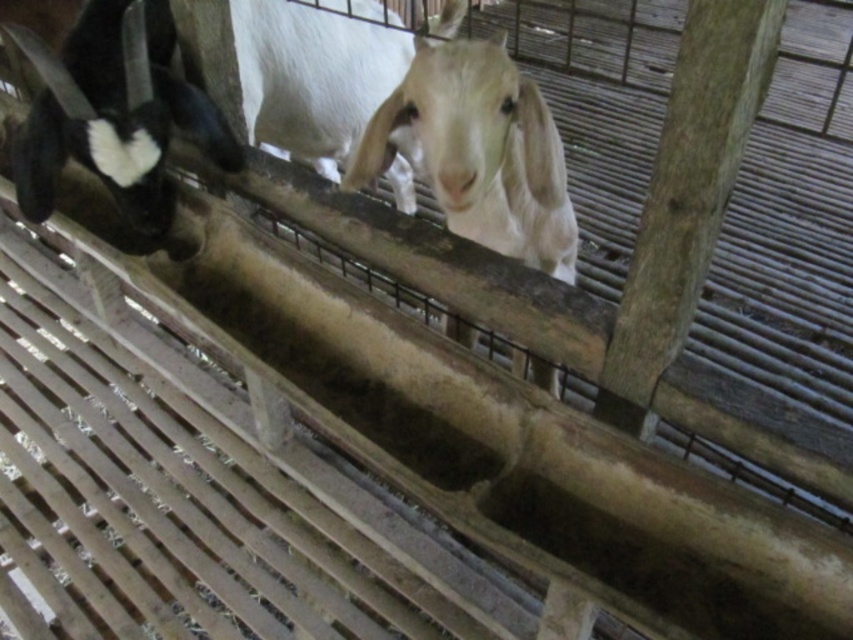
Question: Is white woolen goat at center below white matte goat at upper center?

Choices:
 (A) no
 (B) yes

Answer: (B)

Question: Among these points, which one is nearest to the camera?

Choices:
 (A) (297, 77)
 (B) (172, 100)
 (C) (492, 228)

Answer: (C)

Question: Observing the image, what is the correct spatial positioning of white matte goat at upper center in reference to white matte goat at center?

Choices:
 (A) right
 (B) left

Answer: (B)

Question: Which of these objects is positioned farthest from the white woolen goat at center?

Choices:
 (A) white matte goat at upper center
 (B) white matte goat at center

Answer: (B)

Question: Which point is farther to the camera?

Choices:
 (A) white matte goat at center
 (B) white matte goat at upper center

Answer: (A)

Question: Does white matte goat at upper center lie behind white matte goat at center?

Choices:
 (A) yes
 (B) no

Answer: (B)